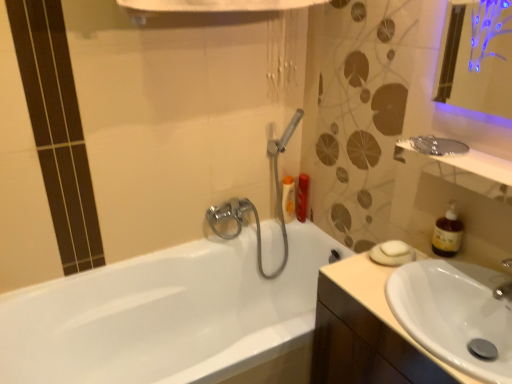
This screenshot has height=384, width=512. Find the location of `free space in front of white matte soap at right`. free space in front of white matte soap at right is located at coordinates (394, 286).